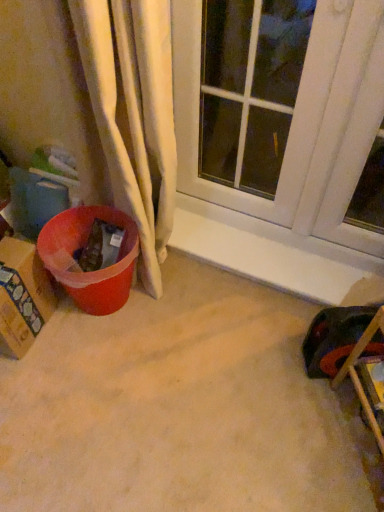
Question: From the image's perspective, is cardboard box at left located beneath wooden chair at lower right?

Choices:
 (A) yes
 (B) no

Answer: (B)

Question: From a real-world perspective, does cardboard box at left sit lower than wooden chair at lower right?

Choices:
 (A) no
 (B) yes

Answer: (B)

Question: Is cardboard box at left at the right side of wooden chair at lower right?

Choices:
 (A) no
 (B) yes

Answer: (A)

Question: Does cardboard box at left lie in front of wooden chair at lower right?

Choices:
 (A) yes
 (B) no

Answer: (B)

Question: Is cardboard box at left surrounding wooden chair at lower right?

Choices:
 (A) no
 (B) yes

Answer: (A)

Question: Considering the positions of white glass window at upper center and wooden chair at lower right in the image, is white glass window at upper center taller or shorter than wooden chair at lower right?

Choices:
 (A) short
 (B) tall

Answer: (B)

Question: Choose the correct answer: Is white glass window at upper center inside wooden chair at lower right or outside it?

Choices:
 (A) outside
 (B) inside

Answer: (A)

Question: From a real-world perspective, is white glass window at upper center above or below wooden chair at lower right?

Choices:
 (A) above
 (B) below

Answer: (A)

Question: Looking at their shapes, would you say white glass window at upper center is wider or thinner than wooden chair at lower right?

Choices:
 (A) wide
 (B) thin

Answer: (B)

Question: Looking at the image, does wooden chair at lower right seem bigger or smaller compared to cardboard box at left?

Choices:
 (A) big
 (B) small

Answer: (A)

Question: Considering the positions of point (354, 357) and point (33, 245), is point (354, 357) closer or farther from the camera than point (33, 245)?

Choices:
 (A) farther
 (B) closer

Answer: (B)

Question: From the image's perspective, relative to cardboard box at left, is wooden chair at lower right above or below?

Choices:
 (A) above
 (B) below

Answer: (B)

Question: From a real-world perspective, relative to cardboard box at left, is wooden chair at lower right vertically above or below?

Choices:
 (A) above
 (B) below

Answer: (A)

Question: In the image, is white glass window at upper center positioned in front of or behind cardboard box at left?

Choices:
 (A) behind
 (B) front

Answer: (B)

Question: In the image, is white glass window at upper center on the left side or the right side of cardboard box at left?

Choices:
 (A) left
 (B) right

Answer: (B)